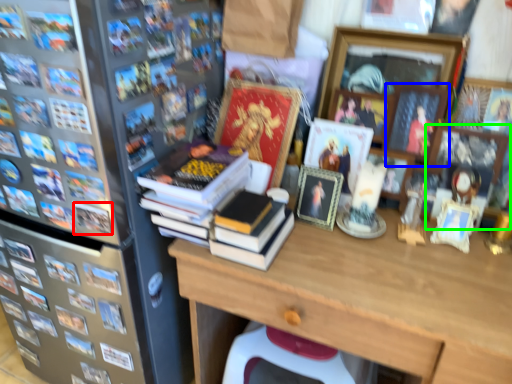
Question: Considering the real-world distances, which object is closest to book (highlighted by a red box)? picture frame (highlighted by a blue box) or picture frame (highlighted by a green box).

Choices:
 (A) picture frame
 (B) picture frame

Answer: (A)